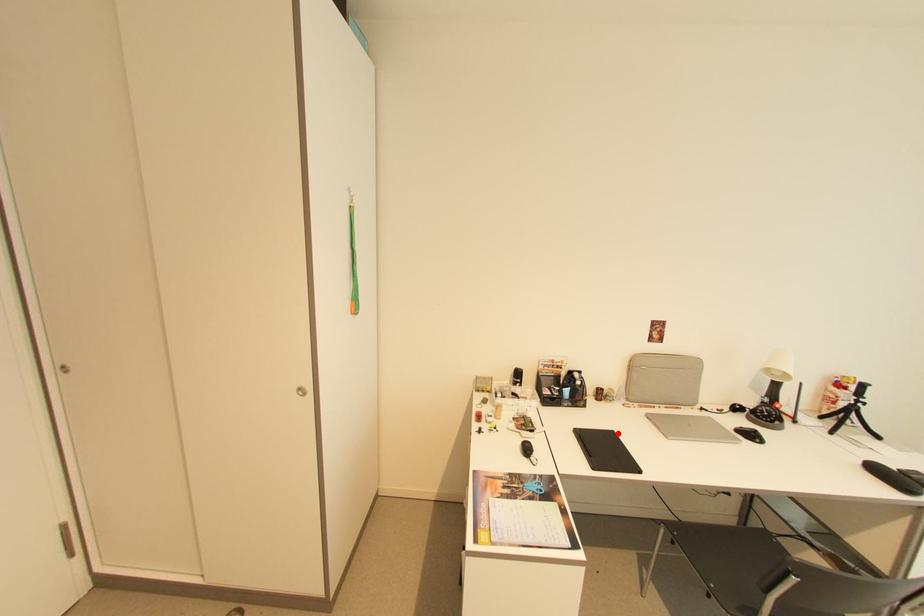
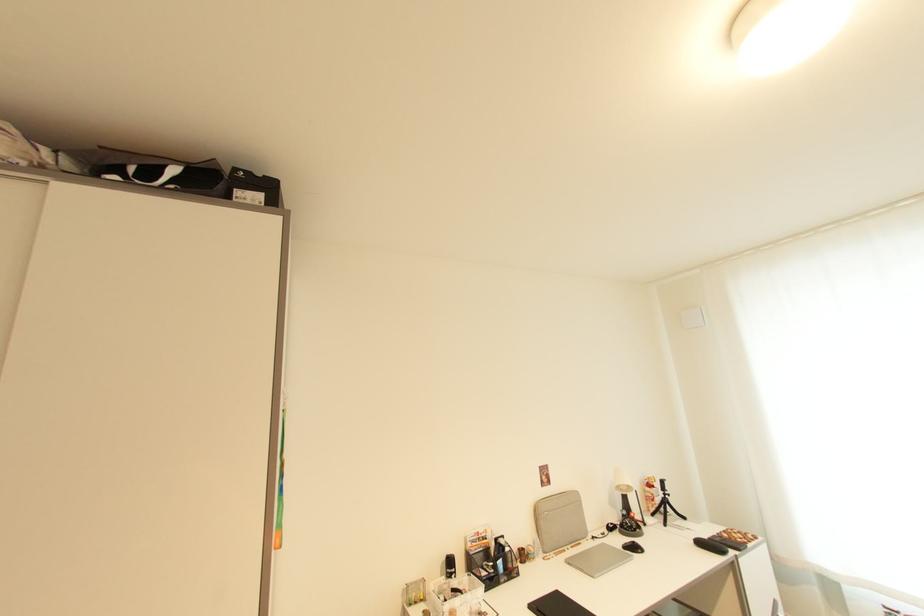
Where in the second image is the point corresponding to the highlighted location from the first image?

(562, 594)